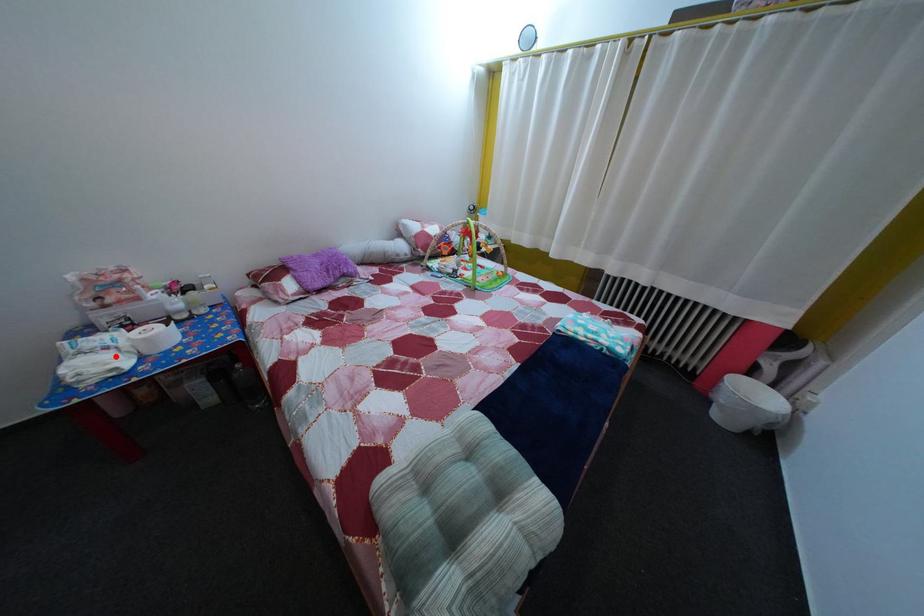
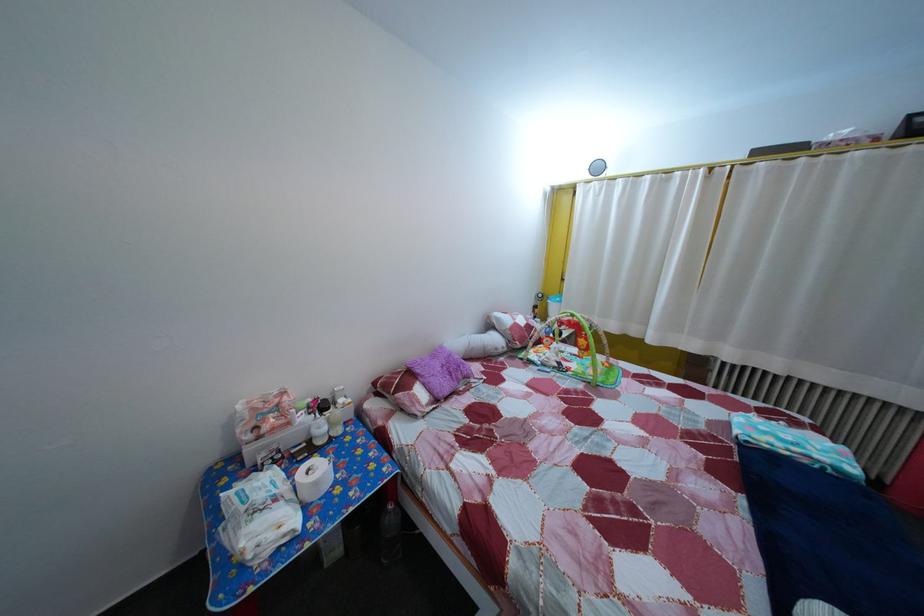
Locate, in the second image, the point that corresponds to the highlighted location in the first image.

(285, 508)